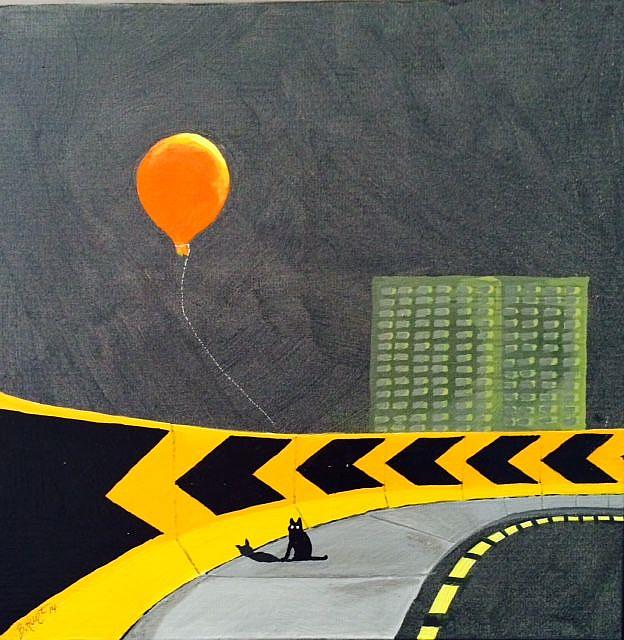
This screenshot has width=624, height=640. I want to click on wall, so click(x=158, y=493).